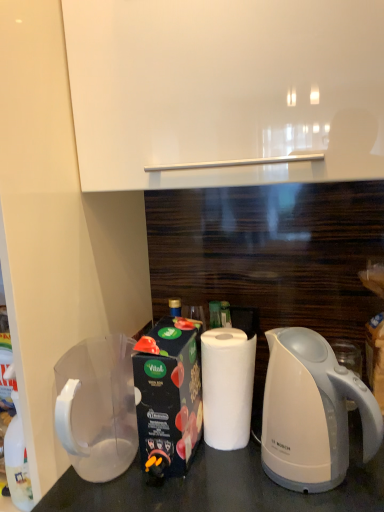
Question: Is white matte paper towel at center positioned far away from transparent plastic pitcher at lower left?

Choices:
 (A) no
 (B) yes

Answer: (A)

Question: From the image's perspective, is white matte paper towel at center on top of transparent plastic pitcher at lower left?

Choices:
 (A) yes
 (B) no

Answer: (A)

Question: From the image's perspective, does white matte paper towel at center appear lower than transparent plastic pitcher at lower left?

Choices:
 (A) no
 (B) yes

Answer: (A)

Question: Is white matte paper towel at center smaller than transparent plastic pitcher at lower left?

Choices:
 (A) no
 (B) yes

Answer: (B)

Question: Considering the relative sizes of white matte paper towel at center and transparent plastic pitcher at lower left in the image provided, is white matte paper towel at center thinner than transparent plastic pitcher at lower left?

Choices:
 (A) no
 (B) yes

Answer: (B)

Question: From a real-world perspective, does white matte paper towel at center sit lower than transparent plastic pitcher at lower left?

Choices:
 (A) yes
 (B) no

Answer: (B)

Question: Is transparent plastic pitcher at lower left thinner than white glossy electric kettle at lower right?

Choices:
 (A) yes
 (B) no

Answer: (B)

Question: Can you confirm if transparent plastic pitcher at lower left is wider than white glossy electric kettle at lower right?

Choices:
 (A) yes
 (B) no

Answer: (A)

Question: Considering the relative sizes of transparent plastic pitcher at lower left and white glossy electric kettle at lower right in the image provided, is transparent plastic pitcher at lower left smaller than white glossy electric kettle at lower right?

Choices:
 (A) no
 (B) yes

Answer: (B)

Question: Considering the relative sizes of transparent plastic pitcher at lower left and white glossy electric kettle at lower right in the image provided, is transparent plastic pitcher at lower left taller than white glossy electric kettle at lower right?

Choices:
 (A) yes
 (B) no

Answer: (B)

Question: Does transparent plastic pitcher at lower left appear on the right side of white glossy electric kettle at lower right?

Choices:
 (A) yes
 (B) no

Answer: (B)

Question: Is transparent plastic pitcher at lower left shorter than white glossy electric kettle at lower right?

Choices:
 (A) yes
 (B) no

Answer: (A)

Question: Does white matte paper towel at center appear on the right side of white glossy electric kettle at lower right?

Choices:
 (A) yes
 (B) no

Answer: (B)